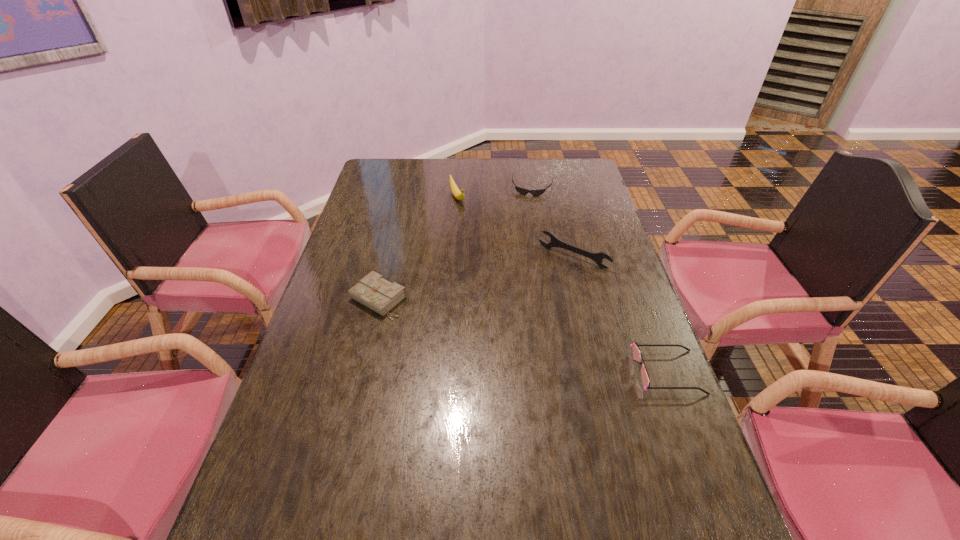
Locate an element on the screen. The image size is (960, 540). free space that is in between the diary and the tallest object is located at coordinates (418, 248).

This screenshot has width=960, height=540. In order to click on empty space between the fourth farthest object and the nearer sunglasses in this screenshot , I will do `click(522, 336)`.

In order to click on vacant region between the third farthest object and the diary in this screenshot , I will do `click(476, 278)`.

This screenshot has height=540, width=960. I want to click on empty location between the third farthest object and the second nearest object, so click(x=476, y=278).

The width and height of the screenshot is (960, 540). What are the coordinates of `free space between the fourth farthest object and the banana` in the screenshot? It's located at (418, 248).

Find the location of a particular element. This screenshot has width=960, height=540. empty space that is in between the leftmost object and the second tallest object is located at coordinates (476, 278).

The width and height of the screenshot is (960, 540). Identify the location of free spot between the second object from left to right and the taller sunglasses. (562, 285).

Find the location of a particular element. Image resolution: width=960 pixels, height=540 pixels. free space between the left sunglasses and the tallest object is located at coordinates (495, 192).

Locate an element on the screen. The height and width of the screenshot is (540, 960). vacant region between the third farthest object and the nearest object is located at coordinates (620, 314).

Image resolution: width=960 pixels, height=540 pixels. Identify the location of free spot between the banana and the shorter sunglasses. (495, 192).